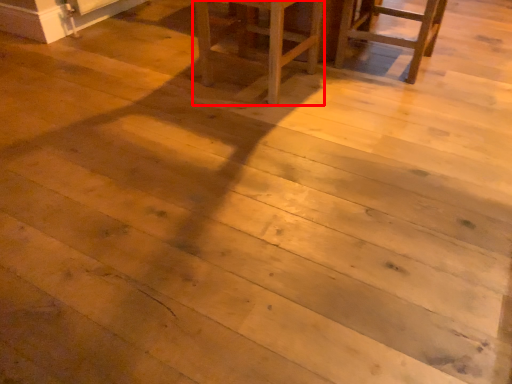
Question: From the image's perspective, where is furniture (annotated by the red box) located relative to chair?

Choices:
 (A) above
 (B) below

Answer: (B)